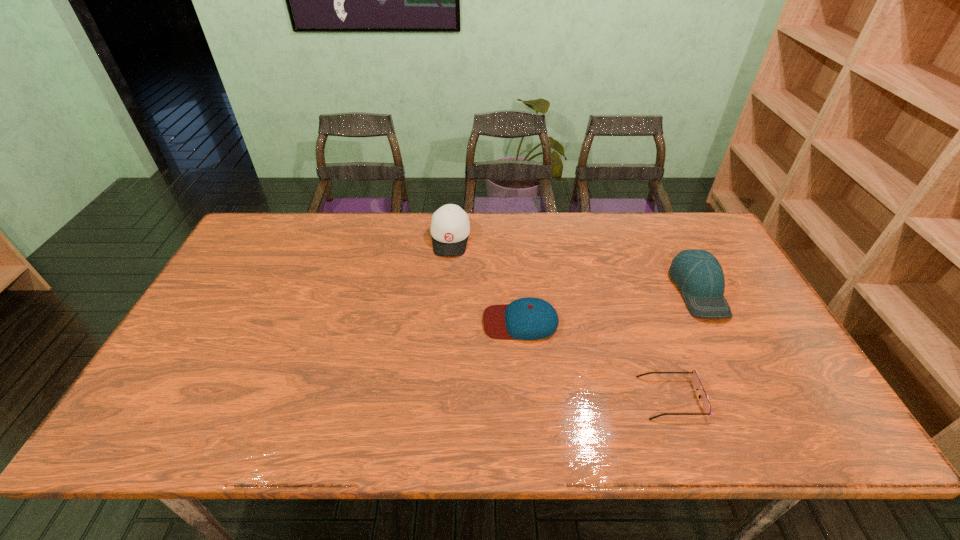
Where is `vacant space located with the bill of the second shortest object facing forward`? vacant space located with the bill of the second shortest object facing forward is located at coordinates (436, 322).

This screenshot has height=540, width=960. Identify the location of blank space located 0.170m with the bill of the second shortest object facing forward. (420, 322).

Find the location of `vacant space situated on the bridge of the shortest object`. vacant space situated on the bridge of the shortest object is located at coordinates (479, 397).

Identify the location of free region located 0.190m on the bridge of the shortest object. The width and height of the screenshot is (960, 540). (561, 397).

At what (x,y) coordinates should I click in order to perform the action: click on free space located on the bridge of the shortest object. Please return your answer as a coordinate pair (x, y). The image size is (960, 540). Looking at the image, I should click on (531, 397).

The width and height of the screenshot is (960, 540). I want to click on object positioned at the far edge, so click(x=450, y=227).

Image resolution: width=960 pixels, height=540 pixels. Identify the location of object present at the near edge. (695, 379).

Locate an element on the screen. The width and height of the screenshot is (960, 540). object that is at the right edge is located at coordinates (698, 274).

Identify the location of vacant region at the far edge of the desktop. Image resolution: width=960 pixels, height=540 pixels. (596, 226).

In the image, there is a desktop. At what (x,y) coordinates should I click in order to perform the action: click on vacant space at the near edge. Please return your answer as a coordinate pair (x, y). This screenshot has width=960, height=540. Looking at the image, I should click on (323, 425).